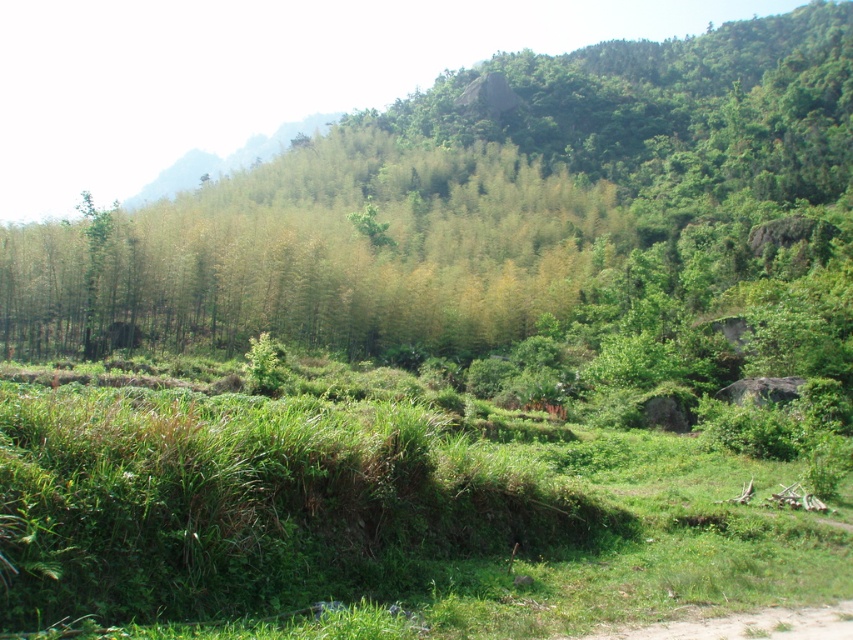
Between green leafy tree at center and green leafy grass at lower left, which one is positioned lower?

green leafy grass at lower left is lower down.

Looking at this image, can you confirm if green leafy tree at center is positioned above green leafy grass at lower left?

Indeed, green leafy tree at center is positioned over green leafy grass at lower left.

Is point (357, 152) positioned in front of point (294, 563)?

No, (357, 152) is further to viewer.

Where is `green leafy tree at center`? This screenshot has width=853, height=640. green leafy tree at center is located at coordinates (508, 227).